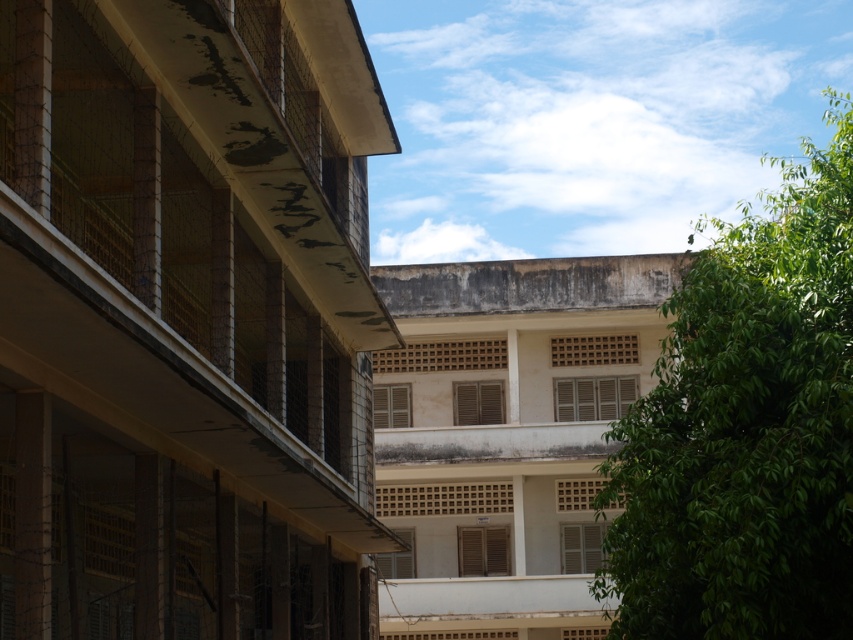
Question: Which point is closer to the camera?

Choices:
 (A) concrete textured balcony at left
 (B) green leafy tree at upper right

Answer: (A)

Question: Is concrete textured balcony at left below green leafy tree at upper right?

Choices:
 (A) no
 (B) yes

Answer: (B)

Question: Which of the following is the closest to the observer?

Choices:
 (A) (758, 224)
 (B) (283, 401)

Answer: (A)

Question: Considering the relative positions of concrete textured balcony at left and green leafy tree at upper right in the image provided, where is concrete textured balcony at left located with respect to green leafy tree at upper right?

Choices:
 (A) left
 (B) right

Answer: (A)

Question: Which object appears farthest from the camera in this image?

Choices:
 (A) green leafy tree at upper right
 (B) concrete textured balcony at left

Answer: (A)

Question: Does concrete textured balcony at left appear on the right side of green leafy tree at upper right?

Choices:
 (A) yes
 (B) no

Answer: (B)